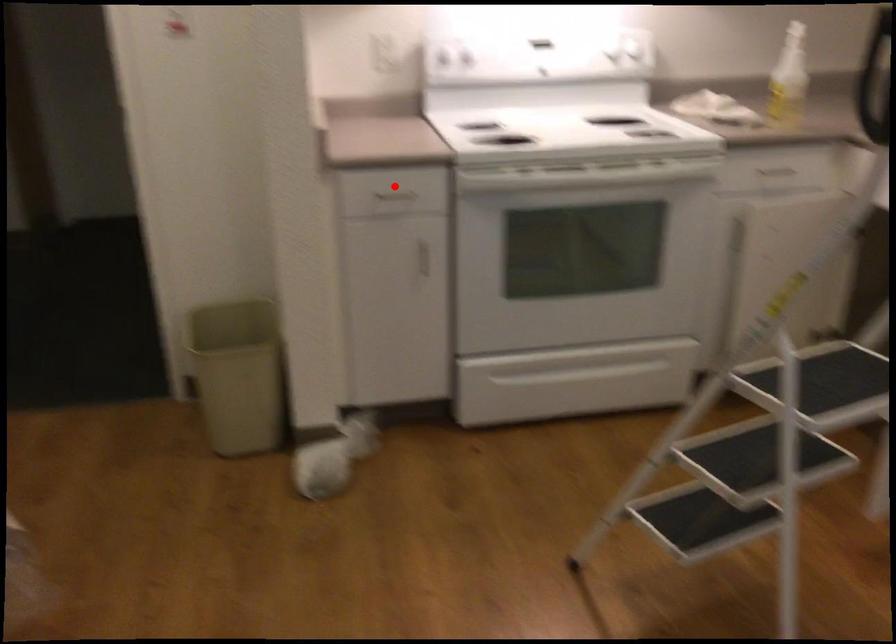
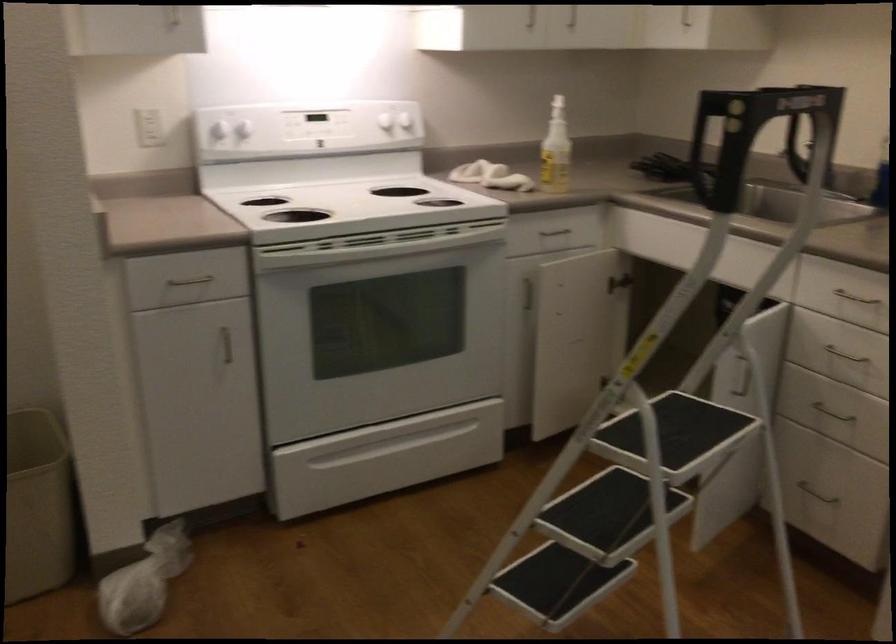
In the second image, find the point that corresponds to the highlighted location in the first image.

(191, 272)